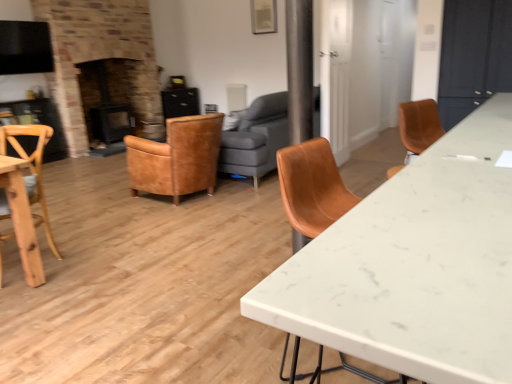
The height and width of the screenshot is (384, 512). I want to click on free location to the right of natural wood chair at left, which ranks as the first chair in front-to-back order, so click(94, 258).